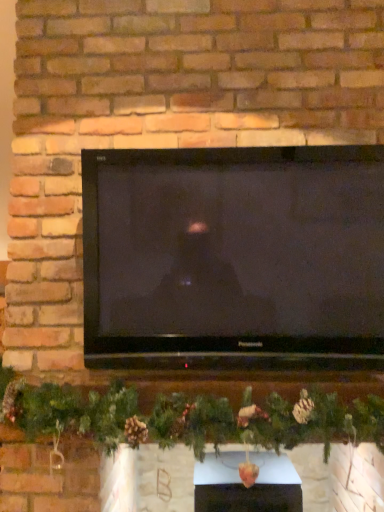
This screenshot has height=512, width=384. Identify the location of black glossy tv at center. (234, 257).

What is the approximate width of white glossy fireplace at center?

The width of white glossy fireplace at center is 39.31 centimeters.

I want to click on green matte garland at center, so click(x=187, y=417).

Find the location of `black glossy tv at center`. black glossy tv at center is located at coordinates (234, 257).

Is white glossy fireplace at center looking in the opposite direction of green matte garland at center?

No, green matte garland at center is not at the back of white glossy fireplace at center.

Is there a large distance between white glossy fireplace at center and green matte garland at center?

They are positioned close to each other.

Is white glossy fireplace at center not inside green matte garland at center?

Indeed, white glossy fireplace at center is completely outside green matte garland at center.

What's the angular difference between white glossy fireplace at center and green matte garland at center's facing directions?

0.00206 degrees.

Is black glossy tv at center looking in the opposite direction of green matte garland at center?

black glossy tv at center is not turned away from green matte garland at center.

Can you confirm if black glossy tv at center is wider than green matte garland at center?

No.

Based on the photo, measure the distance between black glossy tv at center and green matte garland at center.

They are 13.76 inches apart.

Does point (315, 253) come closer to viewer compared to point (33, 408)?

Yes, it is in front of point (33, 408).

Is white glossy fireplace at center surrounded by black glossy tv at center?

Definitely not — white glossy fireplace at center is not inside black glossy tv at center.

This screenshot has width=384, height=512. What are the coordinates of `television in front of the white glossy fireplace at center` in the screenshot? It's located at (234, 257).

Would you say black glossy tv at center is to the left or to the right of white glossy fireplace at center in the picture?

From the image, it's evident that black glossy tv at center is to the left of white glossy fireplace at center.

How many degrees apart are the facing directions of black glossy tv at center and white glossy fireplace at center?

0.00127 degrees.

Between green matte garland at center and black glossy tv at center, which one is positioned behind?

Positioned behind is black glossy tv at center.

Is green matte garland at center not within black glossy tv at center?

Indeed, green matte garland at center is completely outside black glossy tv at center.

From a real-world perspective, is green matte garland at center under black glossy tv at center?

Yes, from a real-world perspective, green matte garland at center is beneath black glossy tv at center.

From a real-world perspective, between white glossy fireplace at center and black glossy tv at center, who is vertically higher?

From a 3D spatial view, black glossy tv at center is above.

Are white glossy fireplace at center and black glossy tv at center located far from each other?

No.

Would you say white glossy fireplace at center is inside or outside black glossy tv at center?

white glossy fireplace at center is spatially situated outside black glossy tv at center.

Identify the location of christmas decoration above the white glossy fireplace at center (from a real-world perspective). The width and height of the screenshot is (384, 512). [187, 417].

From the image's perspective, is green matte garland at center on white glossy fireplace at center?

Yes, from the image's perspective, green matte garland at center is above white glossy fireplace at center.

Considering the positions of points (131, 421) and (221, 486), is point (131, 421) farther from camera compared to point (221, 486)?

No.

Looking at this image, does green matte garland at center have a greater height compared to white glossy fireplace at center?

Yes, green matte garland at center is taller than white glossy fireplace at center.

At what (x,y) coordinates should I click in order to perform the action: click on fireplace behind the green matte garland at center. Please return your answer as a coordinate pair (x, y). This screenshot has height=512, width=384. Looking at the image, I should click on (244, 486).

The height and width of the screenshot is (512, 384). I want to click on television above the green matte garland at center (from a real-world perspective), so click(234, 257).

Based on their spatial positions, is black glossy tv at center or green matte garland at center closer to white glossy fireplace at center?

green matte garland at center is closer to white glossy fireplace at center.

Looking at the image, which one is located further to green matte garland at center, black glossy tv at center or white glossy fireplace at center?

white glossy fireplace at center is further to green matte garland at center.

Estimate the real-world distances between objects in this image. Which object is further from green matte garland at center, white glossy fireplace at center or black glossy tv at center?

white glossy fireplace at center is positioned further to the anchor green matte garland at center.

Based on their spatial positions, is green matte garland at center or white glossy fireplace at center further from black glossy tv at center?

white glossy fireplace at center.

From the image, which object appears to be farther from black glossy tv at center, white glossy fireplace at center or green matte garland at center?

The object further to black glossy tv at center is white glossy fireplace at center.

From the image, which object appears to be farther from white glossy fireplace at center, green matte garland at center or black glossy tv at center?

Among the two, black glossy tv at center is located further to white glossy fireplace at center.

Locate an element on the screen. christmas decoration between black glossy tv at center and white glossy fireplace at center in the up-down direction is located at coordinates (187, 417).